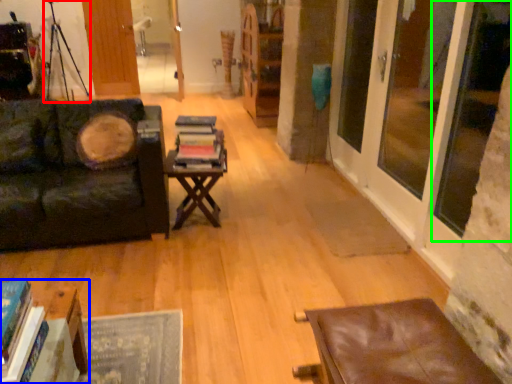
Question: Which object is the closest to the tripod (highlighted by a red box)? Choose among these: table (highlighted by a blue box) or window screen (highlighted by a green box).

Choices:
 (A) table
 (B) window screen

Answer: (A)